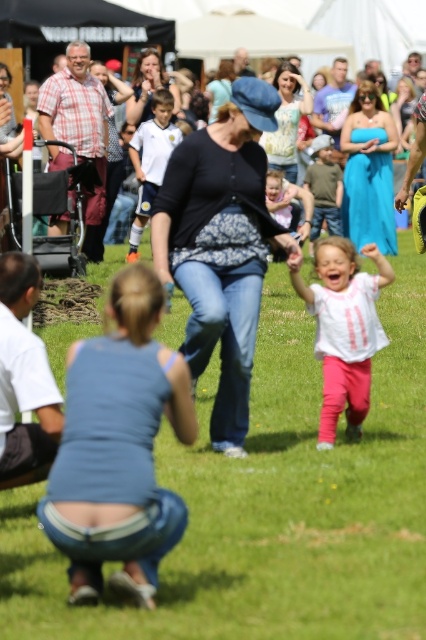
Between green grass at center and blue denim jeans at center, which one is positioned lower?

green grass at center

Can you confirm if green grass at center is thinner than blue denim jeans at center?

No.

Locate an element on the screen. This screenshot has width=426, height=640. green grass at center is located at coordinates (270, 504).

Is green grass at center closer to camera compared to light pink fabric dress at center?

Yes, it is in front of light pink fabric dress at center.

Is green grass at center further to the viewer compared to light pink fabric dress at center?

No.

Does point (388, 486) come in front of point (293, 211)?

Yes, it is in front of point (293, 211).

The width and height of the screenshot is (426, 640). Find the location of `green grass at center`. green grass at center is located at coordinates (270, 504).

Measure the distance between green grass at center and camera.

green grass at center and camera are 4.32 meters apart from each other.

Does point (379, 372) lie behind point (314, 298)?

That is True.

Identify the location of green grass at center. (270, 504).

At what (x,y) coordinates should I click in order to perform the action: click on green grass at center. Please return your answer as a coordinate pair (x, y). This screenshot has width=426, height=640. Looking at the image, I should click on (270, 504).